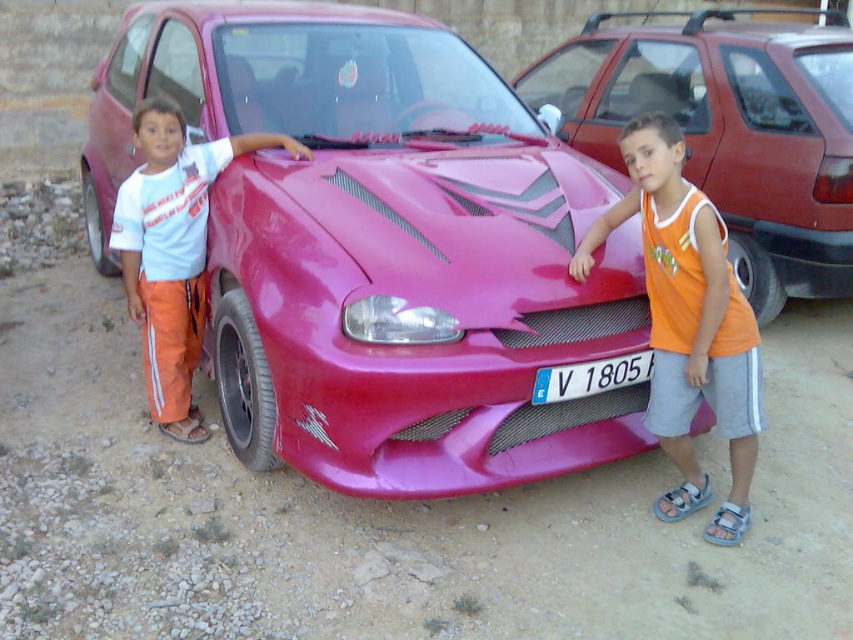
Is shiny pink car at center to the right of orange fabric shirt at center from the viewer's perspective?

No, shiny pink car at center is not to the right of orange fabric shirt at center.

Is point (469, 344) closer to viewer compared to point (692, 454)?

Yes, it is.

Image resolution: width=853 pixels, height=640 pixels. Identify the location of shiny pink car at center. (381, 248).

Can you confirm if shiny pink car at center is thinner than white plastic license plate at center?

No.

Does point (384, 301) lie behind point (543, 397)?

No, it is in front of (543, 397).

Identify the location of shiny pink car at center. (381, 248).

Who is more distant from viewer, (843, 179) or (688, 280)?

Point (843, 179)

Can you confirm if glossy pink car at center is bigger than orange fabric shirt at center?

Yes, glossy pink car at center is bigger than orange fabric shirt at center.

This screenshot has height=640, width=853. Identify the location of glossy pink car at center. (729, 129).

This screenshot has width=853, height=640. In order to click on glossy pink car at center in this screenshot , I will do `click(729, 129)`.